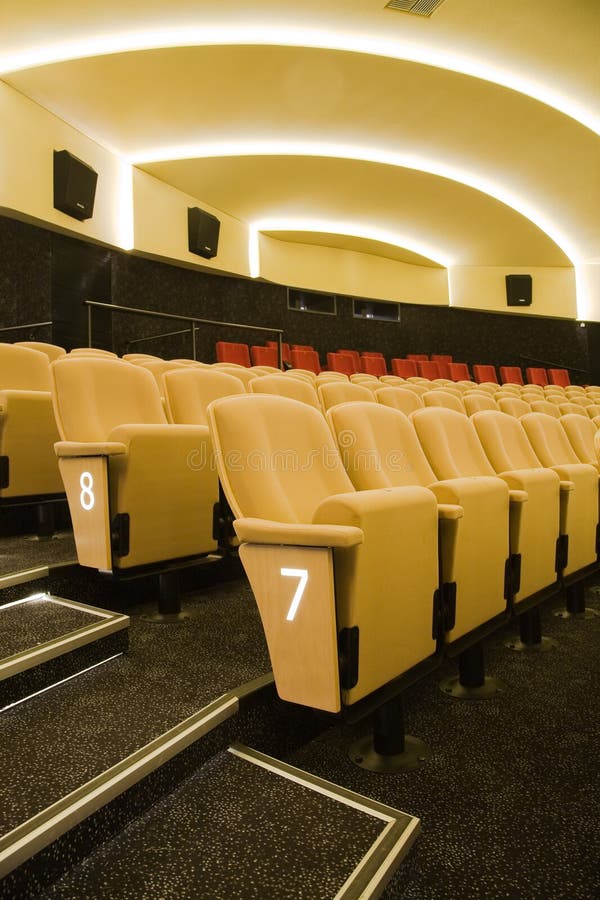
You are a GUI agent. You are given a task and a screenshot of the screen. Output one action in this format:
    pyautogui.click(x=<x>, y=<y>)
    Task: Click on the steps
    This screenshot has width=600, height=900.
    Given the screenshot: What is the action you would take?
    pyautogui.click(x=475, y=859), pyautogui.click(x=287, y=840), pyautogui.click(x=113, y=727), pyautogui.click(x=38, y=634), pyautogui.click(x=20, y=561)